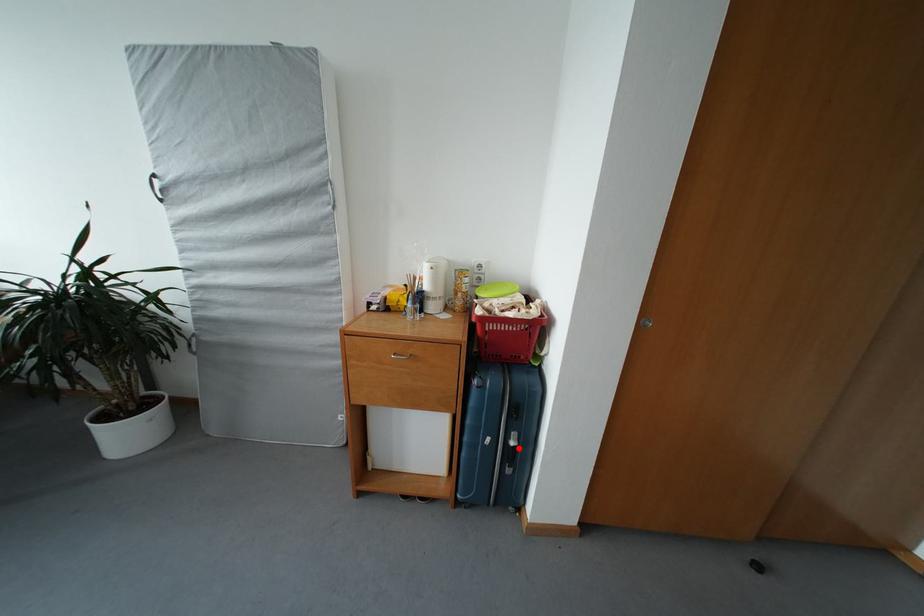
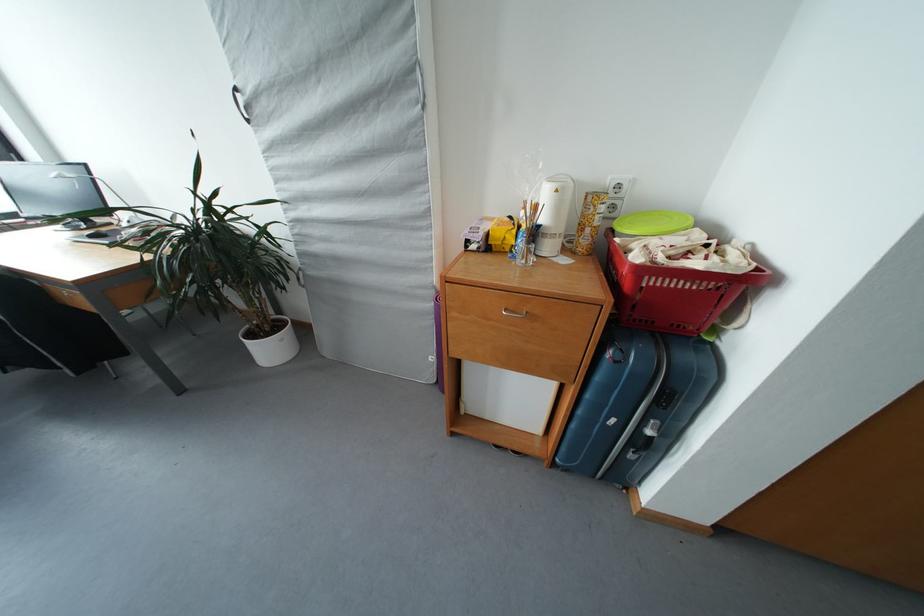
Question: I am providing you with two images of the same scene from different viewpoints. A red point is shown in image1. For the corresponding object point in image2, is it positioned nearer or farther from the camera?

Choices:
 (A) Nearer
 (B) Farther

Answer: (A)